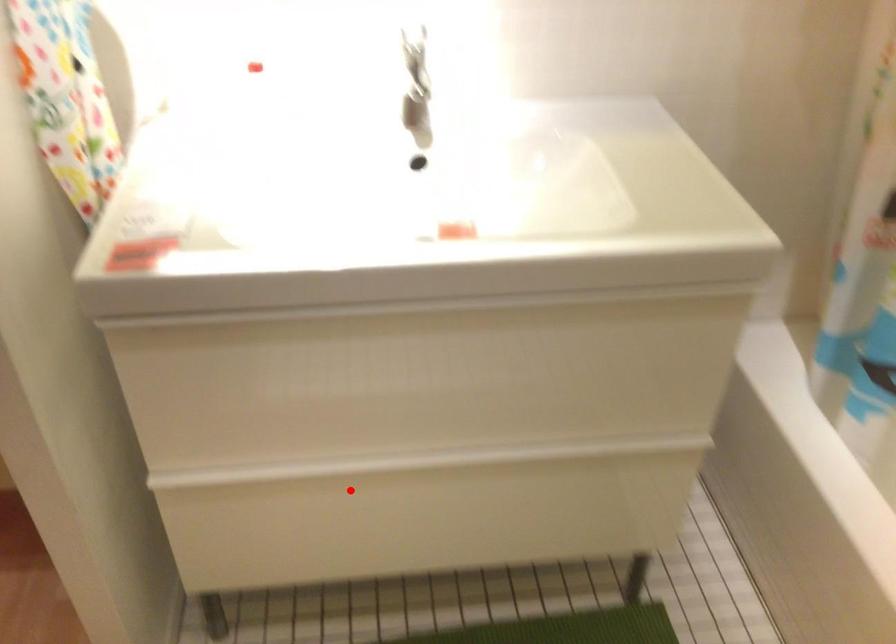
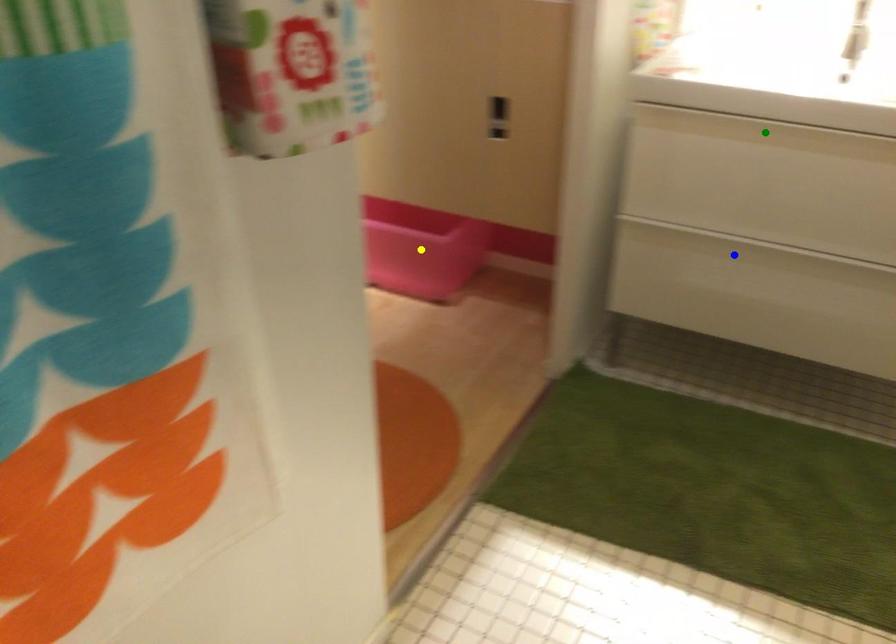
Question: I am providing you with two images of the same scene from different viewpoints. A red point is marked on the first image. You are given multiple points on the second image. In image 2, which mark is for the same physical point as the one in image 1?

Choices:
 (A) yellow point
 (B) blue point
 (C) green point

Answer: (B)